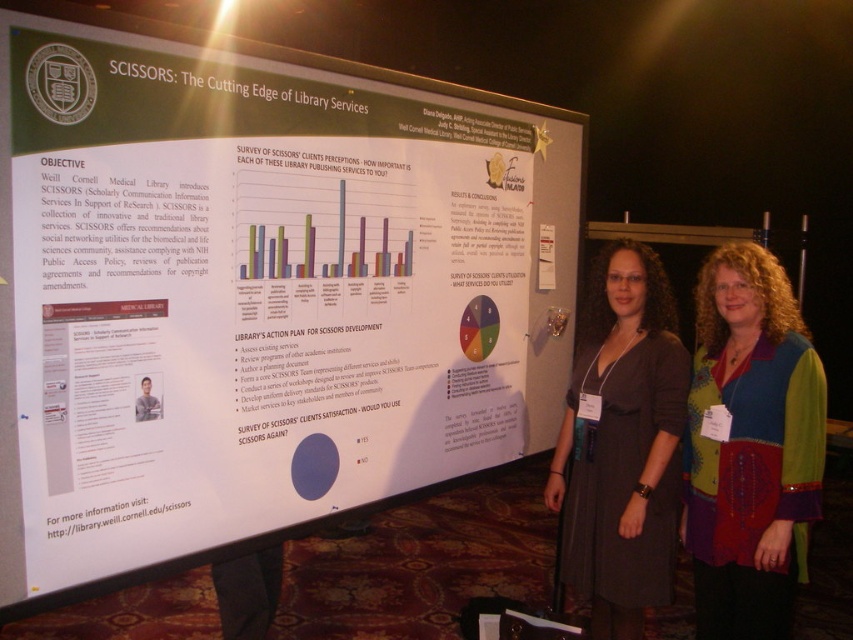
In the scene shown: You are attending a conference and notice two points on the presentation board titled SCISSORS. The first point is at coordinates point (50, 566) and the second is at point (625, 310). From your perspective standing in front of the board, which point is closer to you?

Point (50, 566) is in front of point (625, 310), so it is closer to you.

Based on the photo, what are the coordinates of the white paperboard at center in the image?

The white paperboard at center is located at coordinates point (257, 289).